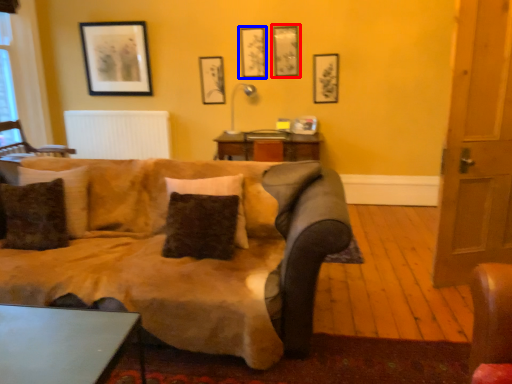
Question: Which object is closer to the camera taking this photo, picture frame (highlighted by a red box) or picture frame (highlighted by a blue box)?

Choices:
 (A) picture frame
 (B) picture frame

Answer: (A)